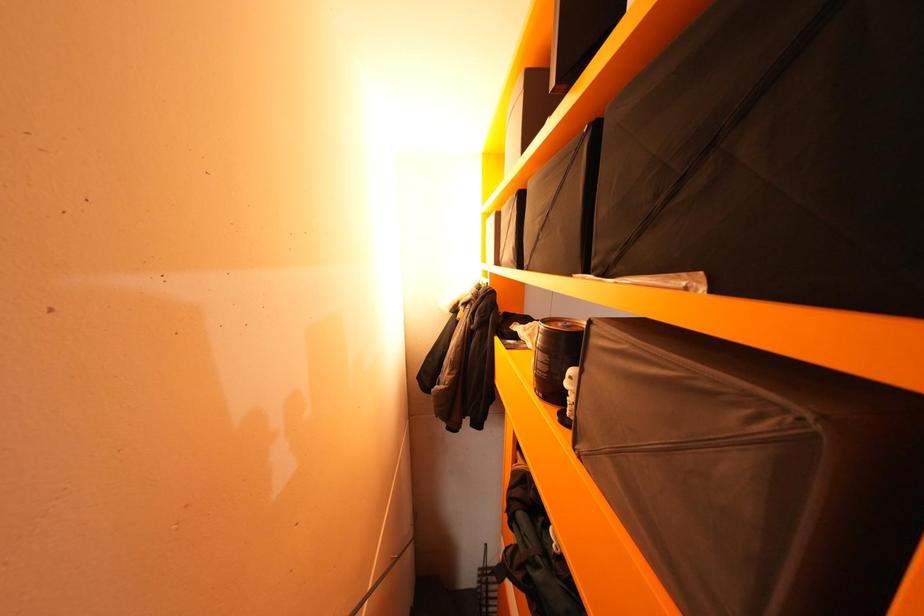
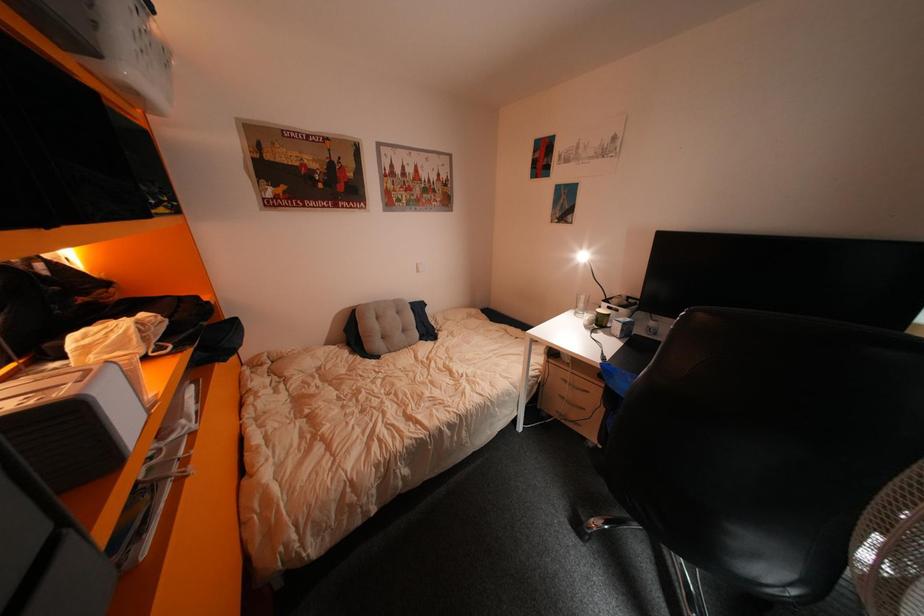
Question: The first image is from the beginning of the video and the second image is from the end. How did the camera likely rotate when shooting the video?

Choices:
 (A) Left
 (B) Right
 (C) Up
 (D) Down

Answer: (B)